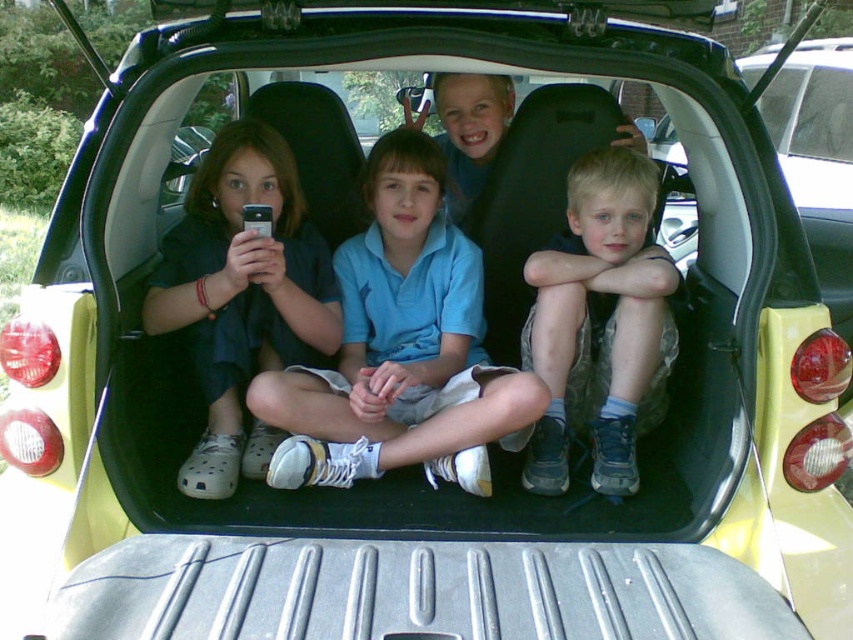
You are a photographer trying to capture a candid shot of the two children in the trunk. The blue cotton shirt at center and the matte black shirt at center are the subjects. Your camera has a depth of field that can focus on objects within 10 inches. Will both subjects be in focus?

The distance between the blue cotton shirt at center and matte black shirt at center is 10.42 inches. Since the depth of field can focus within 10 inches, the 10.42 inches exceeds this range. Therefore, both subjects will not be in focus simultaneously.

Consider the image. You are a photographer trying to capture a candid shot of the children in the car trunk. You notice the blue cotton shirt at center and the blue fabric shorts at center. Which clothing item takes up more space in the photo frame?

The blue cotton shirt at center is bigger than the blue fabric shorts at center, so it takes up more space in the photo frame.

You are a photographer trying to capture a photo of the children in the car trunk. You notice two points marked in the image. Which point is closer to you, point [329,282] or point [643,208]?

Point [329,282] is closer to you than point [643,208] because it is further to the viewer.